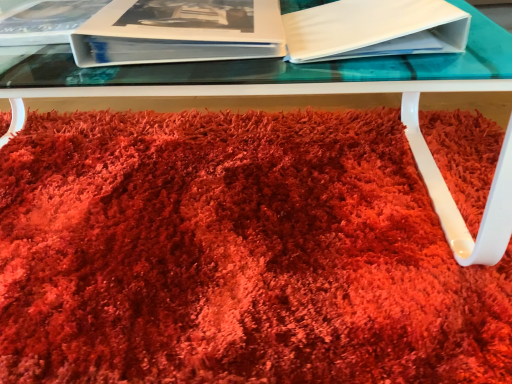
Question: From a real-world perspective, is white glossy book at upper left, acting as the first paperback book starting from the left, physically below white matte book at upper right, which is the second paperback book in left-to-right order?

Choices:
 (A) no
 (B) yes

Answer: (B)

Question: Is white glossy book at upper left, acting as the first paperback book starting from the left, turned away from white matte book at upper right, the 1th paperback book from the right?

Choices:
 (A) no
 (B) yes

Answer: (A)

Question: Can you confirm if white glossy book at upper left, the second paperback book viewed from the right, is taller than white matte book at upper right, the 1th paperback book from the right?

Choices:
 (A) yes
 (B) no

Answer: (A)

Question: Considering the relative positions of white glossy book at upper left, the second paperback book viewed from the right, and white matte book at upper right, the 1th paperback book from the right, in the image provided, is white glossy book at upper left, the second paperback book viewed from the right, to the left of white matte book at upper right, the 1th paperback book from the right, from the viewer's perspective?

Choices:
 (A) yes
 (B) no

Answer: (A)

Question: Considering the relative positions of white glossy book at upper left, the second paperback book viewed from the right, and white matte book at upper right, the 1th paperback book from the right, in the image provided, is white glossy book at upper left, the second paperback book viewed from the right, in front of white matte book at upper right, the 1th paperback book from the right,?

Choices:
 (A) yes
 (B) no

Answer: (B)

Question: From a real-world perspective, is white glossy book at upper left, acting as the first paperback book starting from the left, physically above white matte book at upper right, the 1th paperback book from the right?

Choices:
 (A) no
 (B) yes

Answer: (A)

Question: From a real-world perspective, is white glossy album at upper left located higher than shaggy red carpet at center?

Choices:
 (A) no
 (B) yes

Answer: (B)

Question: Is the position of white glossy album at upper left less distant than that of shaggy red carpet at center?

Choices:
 (A) no
 (B) yes

Answer: (A)

Question: Does white glossy album at upper left have a greater width compared to shaggy red carpet at center?

Choices:
 (A) yes
 (B) no

Answer: (B)

Question: Is white glossy album at upper left turned away from shaggy red carpet at center?

Choices:
 (A) yes
 (B) no

Answer: (B)

Question: Is white glossy album at upper left smaller than shaggy red carpet at center?

Choices:
 (A) no
 (B) yes

Answer: (B)

Question: Is white glossy album at upper left next to shaggy red carpet at center and touching it?

Choices:
 (A) yes
 (B) no

Answer: (B)

Question: Is shaggy red carpet at center facing towards white matte book at upper right, the 1th paperback book from the right?

Choices:
 (A) no
 (B) yes

Answer: (A)